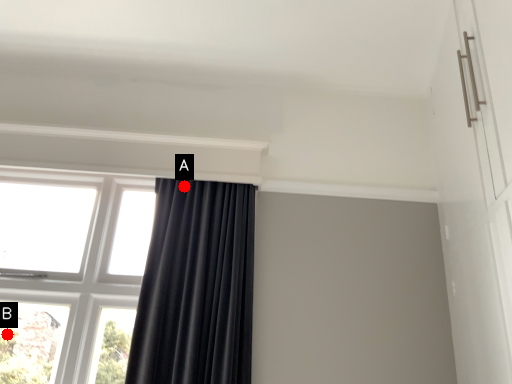
Question: Two points are circled on the image, labeled by A and B beside each circle. Which point is further to the camera?

Choices:
 (A) A is further
 (B) B is further

Answer: (A)